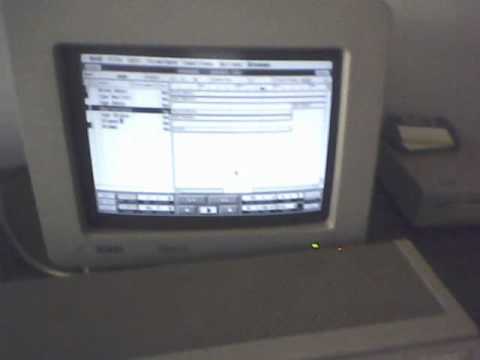
In order to click on bottom of monitor in this screenshot , I will do `click(200, 246)`.